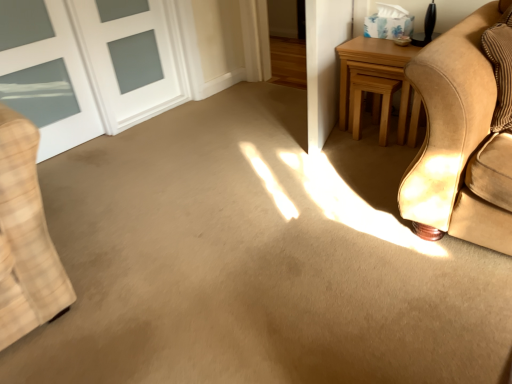
Question: From a real-world perspective, is light brown wood stool at upper right above or below white glass door at upper left?

Choices:
 (A) below
 (B) above

Answer: (A)

Question: From their relative heights in the image, would you say light brown wood stool at upper right is taller or shorter than white glass door at upper left?

Choices:
 (A) tall
 (B) short

Answer: (B)

Question: Considering the real-world distances, which object is closest to the white glass door at upper left?

Choices:
 (A) light brown wooden table at right
 (B) light brown wood stool at upper right

Answer: (A)

Question: Based on their relative distances, which object is nearer to the light brown wood stool at upper right?

Choices:
 (A) light brown wooden table at right
 (B) white glass door at upper left

Answer: (A)